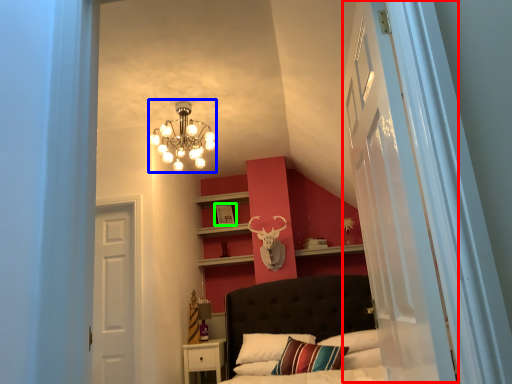
Question: Based on their relative distances, which object is farther from glass door (highlighted by a red box)? Choose from lamp (highlighted by a blue box) and picture frame (highlighted by a green box).

Choices:
 (A) lamp
 (B) picture frame

Answer: (B)